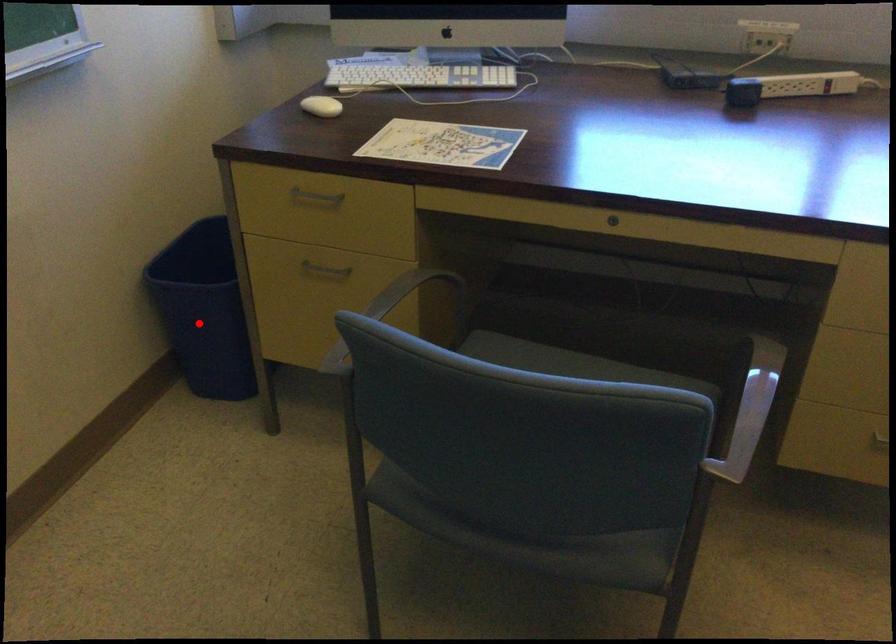
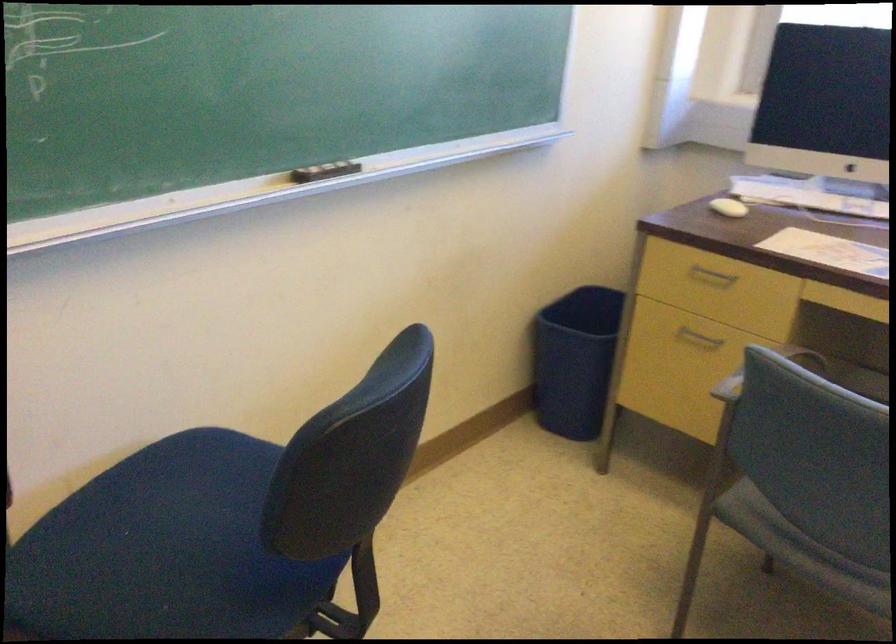
Question: I am providing you with two images of the same scene from different viewpoints. In image1, a red point is highlighted. Considering the same 3D point in image2, which of the following is correct?

Choices:
 (A) It is closer
 (B) It is farther

Answer: (B)